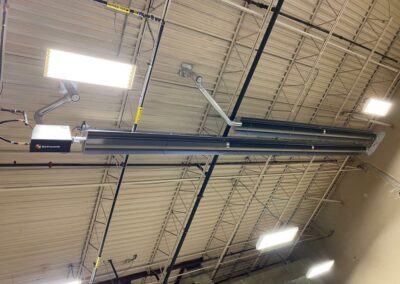
The width and height of the screenshot is (400, 284). I want to click on light fixtures, so click(x=384, y=108), click(x=291, y=239), click(x=324, y=270), click(x=72, y=281).